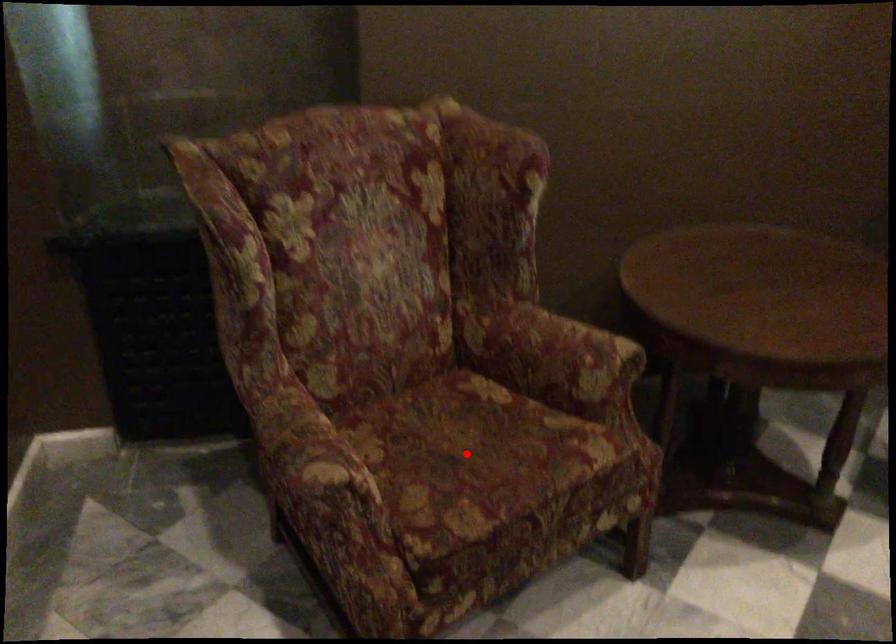
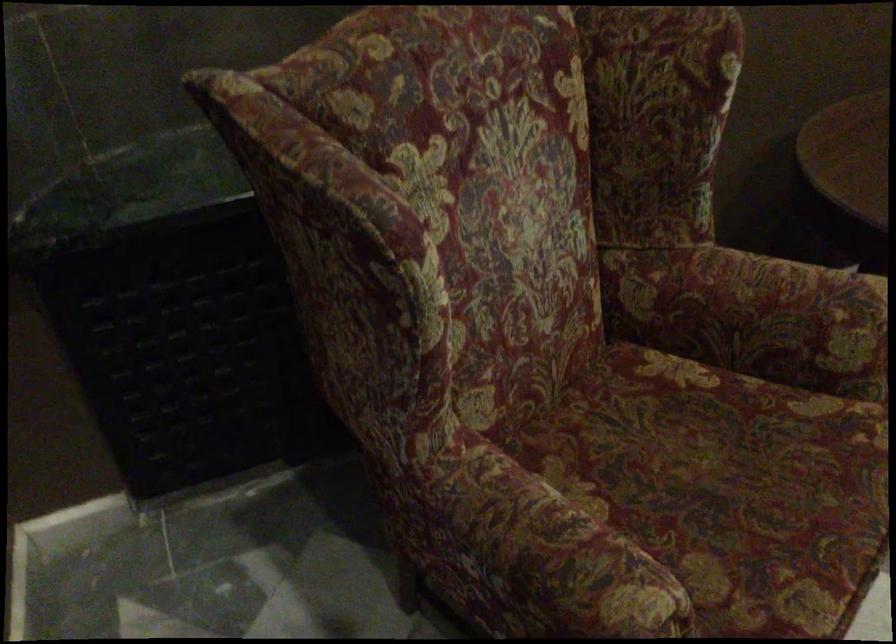
Question: I am providing you with two images of the same scene from different viewpoints. A red point is shown in image1. For the corresponding object point in image2, is it positioned nearer or farther from the camera?

Choices:
 (A) Nearer
 (B) Farther

Answer: (A)